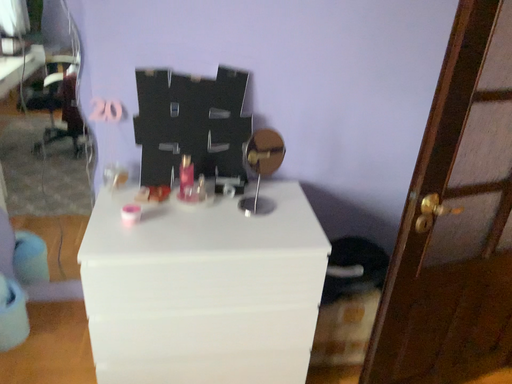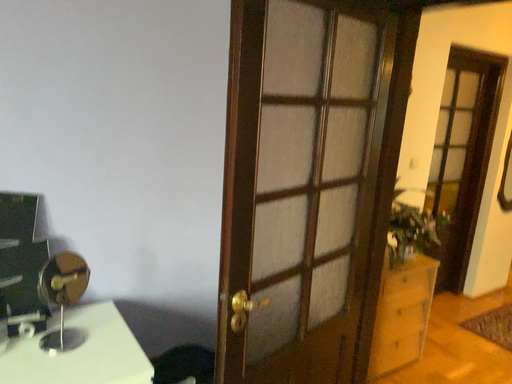
Question: How did the camera likely rotate when shooting the video?

Choices:
 (A) rotated downward
 (B) rotated upward

Answer: (B)